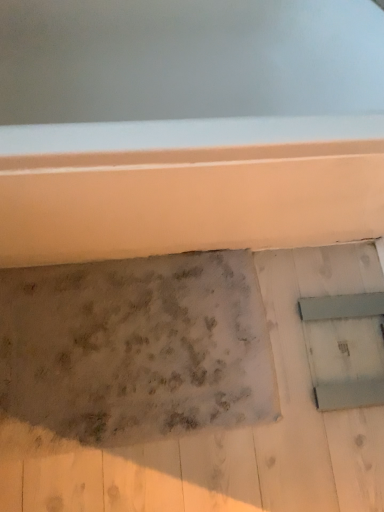
Question: In the image, is speckled concrete wall at center positioned in front of or behind metallic gray window at lower right?

Choices:
 (A) front
 (B) behind

Answer: (A)

Question: In terms of size, does speckled concrete wall at center appear bigger or smaller than metallic gray window at lower right?

Choices:
 (A) big
 (B) small

Answer: (A)

Question: From a real-world perspective, relative to metallic gray window at lower right, is speckled concrete wall at center vertically above or below?

Choices:
 (A) below
 (B) above

Answer: (A)

Question: From a real-world perspective, relative to speckled concrete wall at center, is metallic gray window at lower right vertically above or below?

Choices:
 (A) above
 (B) below

Answer: (A)

Question: Is metallic gray window at lower right taller or shorter than speckled concrete wall at center?

Choices:
 (A) short
 (B) tall

Answer: (A)

Question: Would you say metallic gray window at lower right is to the left or to the right of speckled concrete wall at center in the picture?

Choices:
 (A) left
 (B) right

Answer: (B)

Question: Considering the positions of metallic gray window at lower right and speckled concrete wall at center in the image, is metallic gray window at lower right bigger or smaller than speckled concrete wall at center?

Choices:
 (A) small
 (B) big

Answer: (A)